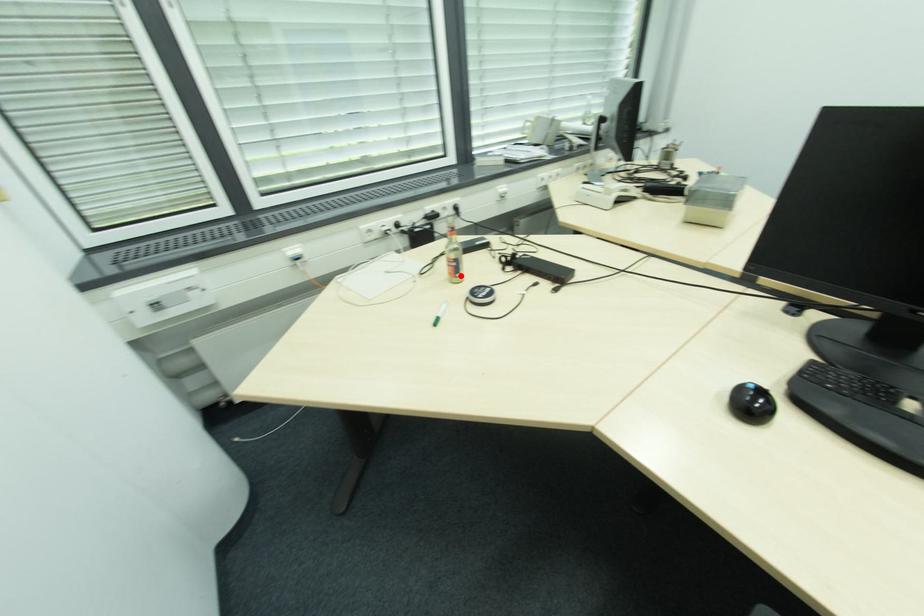
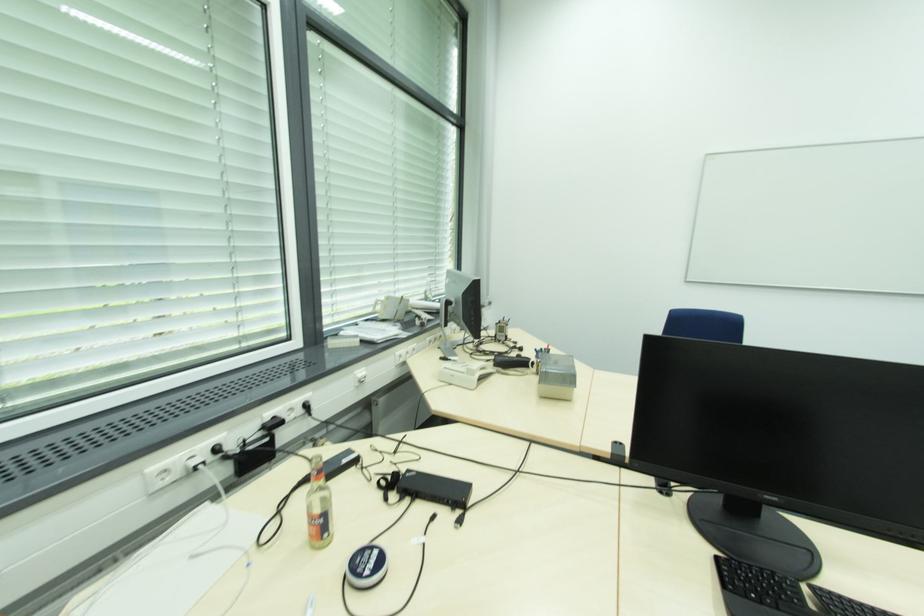
Find the pixel in the second image that matches the highlighted location in the first image.

(329, 535)